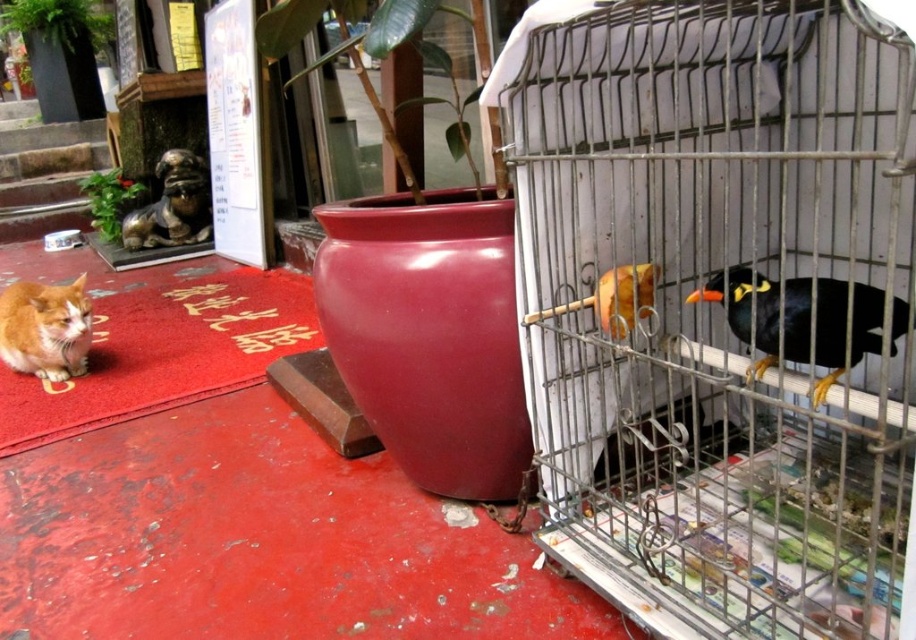
Find the location of `metallic wire birdcage at right`. metallic wire birdcage at right is located at coordinates (718, 307).

Is metallic wire birdcage at right positioned behind black glossy bird at right?

No.

Who is more forward, (x=811, y=538) or (x=777, y=330)?

Point (x=777, y=330) is more forward.

I want to click on metallic wire birdcage at right, so point(718,307).

Does black glossy bird at right have a larger size compared to orange fur cat at left?

Actually, black glossy bird at right might be smaller than orange fur cat at left.

Does black glossy bird at right have a lesser height compared to orange fur cat at left?

Indeed, black glossy bird at right has a lesser height compared to orange fur cat at left.

Between point (823, 342) and point (41, 337), which one is positioned in front?

Positioned in front is point (823, 342).

At what (x,y) coordinates should I click in order to perform the action: click on black glossy bird at right. Please return your answer as a coordinate pair (x, y). Looking at the image, I should click on (747, 310).

Is metallic wire birdcage at right to the right of orange fur cat at left from the viewer's perspective?

Yes, metallic wire birdcage at right is to the right of orange fur cat at left.

Is metallic wire birdcage at right wider than orange fur cat at left?

Correct, the width of metallic wire birdcage at right exceeds that of orange fur cat at left.

In the scene shown: Who is more forward, (834,561) or (14,288)?

Positioned in front is point (834,561).

The width and height of the screenshot is (916, 640). I want to click on metallic wire birdcage at right, so pos(718,307).